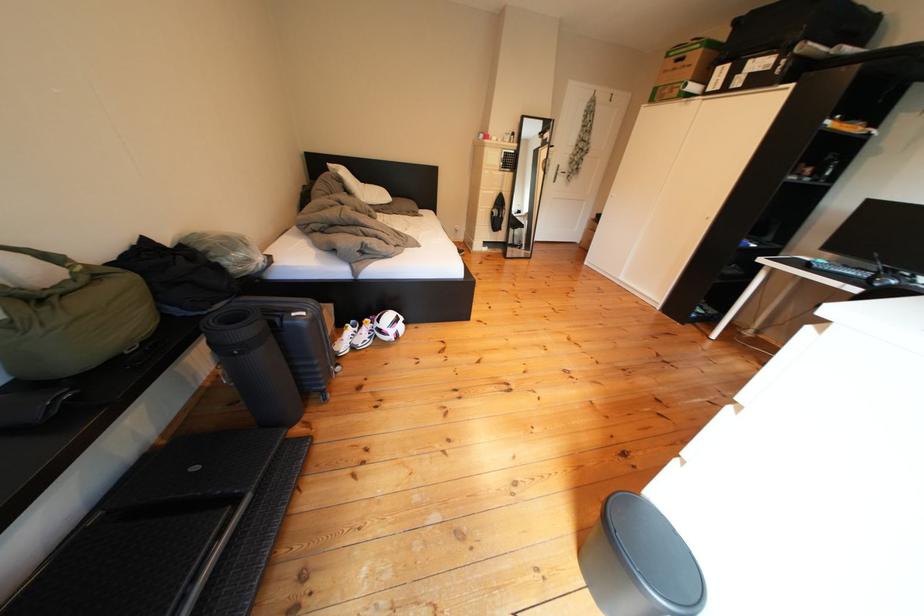
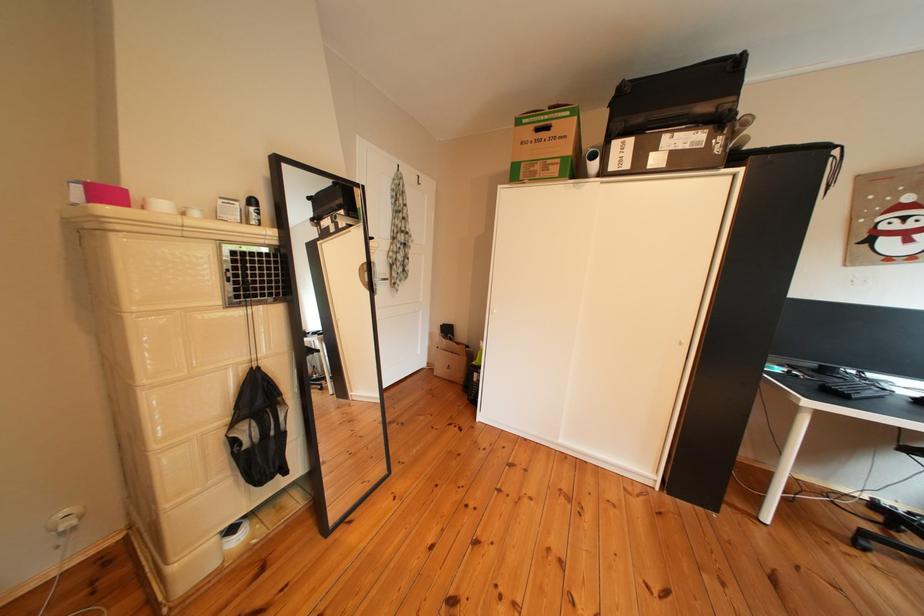
Locate, in the second image, the point that corresponds to point (501, 140) in the first image.

(123, 199)